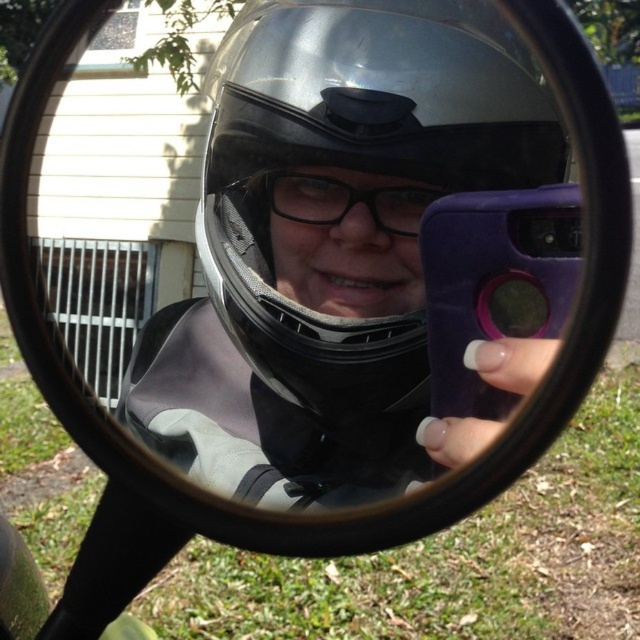
Does transparent matte helmet at center appear under black matte glasses at center?

No.

Is transparent matte helmet at center bigger than black matte glasses at center?

Yes.

Locate an element on the screen. transparent matte helmet at center is located at coordinates coord(356,163).

Locate an element on the screen. Image resolution: width=640 pixels, height=640 pixels. transparent matte helmet at center is located at coordinates (356, 163).